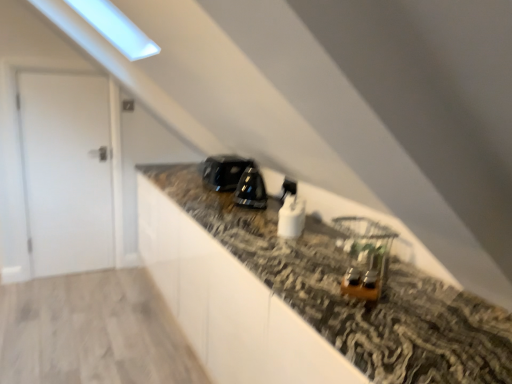
Question: From the image's perspective, would you say wooden earrings at center, acting as the fifth appliance starting from the left, is shown under black glossy kettle at center, marked as the third appliance in a front-to-back arrangement?

Choices:
 (A) yes
 (B) no

Answer: (A)

Question: Considering the relative sizes of wooden earrings at center, the first appliance viewed from the right, and black glossy kettle at center, which is the 2th appliance from left to right, in the image provided, is wooden earrings at center, the first appliance viewed from the right, wider than black glossy kettle at center, which is the 2th appliance from left to right,?

Choices:
 (A) no
 (B) yes

Answer: (A)

Question: Can you confirm if wooden earrings at center, which ranks as the first appliance in front-to-back order, is thinner than black glossy kettle at center, which is the 2th appliance from left to right?

Choices:
 (A) yes
 (B) no

Answer: (A)

Question: Could you tell me if wooden earrings at center, arranged as the 5th appliance when viewed from the back, is turned towards black glossy kettle at center, marked as the third appliance in a front-to-back arrangement?

Choices:
 (A) no
 (B) yes

Answer: (A)

Question: Considering the relative positions of wooden earrings at center, which ranks as the first appliance in front-to-back order, and black glossy kettle at center, which is the 2th appliance from left to right, in the image provided, is wooden earrings at center, which ranks as the first appliance in front-to-back order, behind black glossy kettle at center, which is the 2th appliance from left to right,?

Choices:
 (A) no
 (B) yes

Answer: (A)

Question: From the image's perspective, is white matte door at left positioned above or below white glossy plug at center, which is the third appliance in right-to-left order?

Choices:
 (A) above
 (B) below

Answer: (A)

Question: Considering the positions of white matte door at left and white glossy plug at center, marked as the second appliance in a front-to-back arrangement, in the image, is white matte door at left taller or shorter than white glossy plug at center, marked as the second appliance in a front-to-back arrangement,?

Choices:
 (A) tall
 (B) short

Answer: (A)

Question: Looking at the image, does white matte door at left seem bigger or smaller compared to white glossy plug at center, which is the third appliance in right-to-left order?

Choices:
 (A) small
 (B) big

Answer: (B)

Question: From a real-world perspective, relative to white glossy plug at center, which is the third appliance in right-to-left order, is white matte door at left vertically above or below?

Choices:
 (A) below
 (B) above

Answer: (A)

Question: Considering the relative positions of glossy black toaster at center, arranged as the 1th appliance when viewed from the left, and black glossy kettle at center, marked as the third appliance in a front-to-back arrangement, in the image provided, is glossy black toaster at center, arranged as the 1th appliance when viewed from the left, to the left or to the right of black glossy kettle at center, marked as the third appliance in a front-to-back arrangement,?

Choices:
 (A) right
 (B) left

Answer: (B)

Question: From their relative heights in the image, would you say glossy black toaster at center, placed as the fifth appliance when sorted from front to back, is taller or shorter than black glossy kettle at center, which is counted as the 4th appliance, starting from the right?

Choices:
 (A) tall
 (B) short

Answer: (A)

Question: Considering the positions of point (217, 180) and point (253, 200), is point (217, 180) closer or farther from the camera than point (253, 200)?

Choices:
 (A) farther
 (B) closer

Answer: (A)

Question: Relative to black glossy kettle at center, marked as the 3th appliance in a back-to-front arrangement, is glossy black toaster at center, acting as the fifth appliance starting from the right, in front or behind?

Choices:
 (A) behind
 (B) front

Answer: (A)

Question: Would you say glossy black toaster at center, placed as the fifth appliance when sorted from front to back, is to the left or to the right of white glossy plug at center, which is the third appliance in right-to-left order, in the picture?

Choices:
 (A) left
 (B) right

Answer: (A)

Question: Does point (210, 175) appear closer or farther from the camera than point (281, 236)?

Choices:
 (A) farther
 (B) closer

Answer: (A)